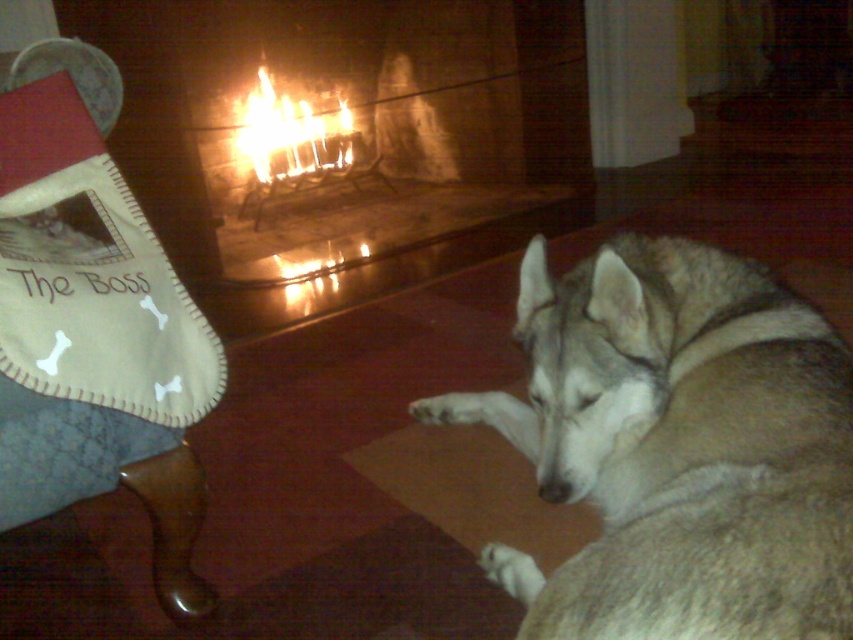
Is the position of brick fireplace at center less distant than that of flamematerial/texture at center?

That is True.

Between point (252, 52) and point (248, 129), which one is positioned in front?

Point (252, 52) is in front.

Where is `brick fireplace at center`? brick fireplace at center is located at coordinates pyautogui.click(x=360, y=131).

Between fuzzy gray dog at lower right and flamematerial/texture at center, which one appears on the right side from the viewer's perspective?

fuzzy gray dog at lower right

Is point (563, 280) positioned behind point (258, 138)?

No.

Find the location of `fuzzy gray dog at lower right`. fuzzy gray dog at lower right is located at coordinates (677, 448).

Does brick fireplace at center appear over denim fabric armchair at left?

Correct, brick fireplace at center is located above denim fabric armchair at left.

Does point (309, 72) come behind point (194, 472)?

Yes, point (309, 72) is farther from viewer.

Is point (514, 120) positioned after point (180, 474)?

Yes, point (514, 120) is behind point (180, 474).

Identify the location of brick fireplace at center. Image resolution: width=853 pixels, height=640 pixels. (360, 131).